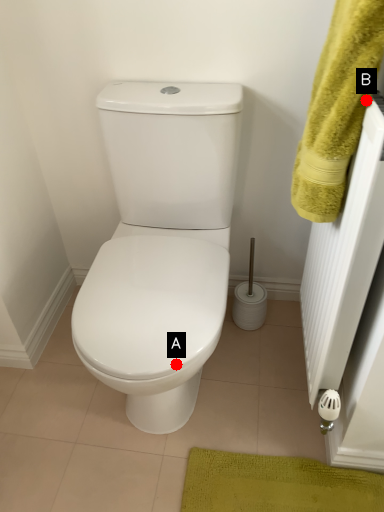
Question: Two points are circled on the image, labeled by A and B beside each circle. Which point is farther to the camera?

Choices:
 (A) A is further
 (B) B is further

Answer: (A)